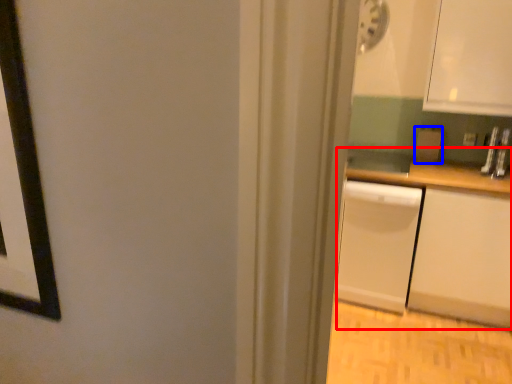
Question: Which of the following is the farthest to the observer, counter (highlighted by a red box) or appliance (highlighted by a blue box)?

Choices:
 (A) counter
 (B) appliance

Answer: (B)